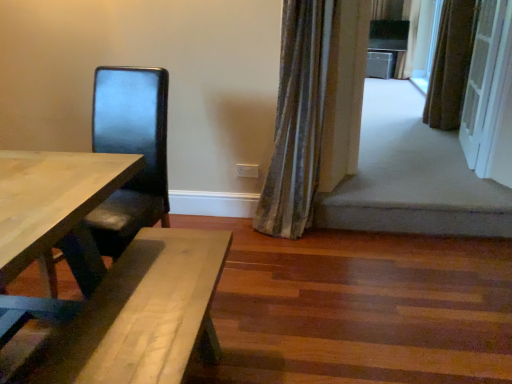
Question: Does velvet-like curtain at upper right, the 1th curtain viewed from the left, have a smaller size compared to white textured screen door at upper right?

Choices:
 (A) yes
 (B) no

Answer: (B)

Question: Is velvet-like curtain at upper right, acting as the 1th curtain starting from the bottom, shorter than white textured screen door at upper right?

Choices:
 (A) no
 (B) yes

Answer: (A)

Question: Is white textured screen door at upper right located within velvet-like curtain at upper right, the 3th curtain positioned from the right?

Choices:
 (A) yes
 (B) no

Answer: (B)

Question: From a real-world perspective, is velvet-like curtain at upper right, the 1th curtain viewed from the left, physically above white textured screen door at upper right?

Choices:
 (A) no
 (B) yes

Answer: (A)

Question: From the image's perspective, is velvet-like curtain at upper right, the third curtain viewed from the back, located above white textured screen door at upper right?

Choices:
 (A) no
 (B) yes

Answer: (A)

Question: From a real-world perspective, is velvet-like curtain at upper right, the third curtain viewed from the back, beneath white textured screen door at upper right?

Choices:
 (A) no
 (B) yes

Answer: (B)

Question: From a real-world perspective, is matte black chair at left located higher than brown textured curtain at upper right, which is the second curtain from top to bottom?

Choices:
 (A) yes
 (B) no

Answer: (B)

Question: Does matte black chair at left have a lesser height compared to brown textured curtain at upper right, the 2th curtain in the right-to-left sequence?

Choices:
 (A) no
 (B) yes

Answer: (B)

Question: Considering the relative sizes of matte black chair at left and brown textured curtain at upper right, positioned as the 2th curtain in front-to-back order, in the image provided, is matte black chair at left smaller than brown textured curtain at upper right, positioned as the 2th curtain in front-to-back order,?

Choices:
 (A) no
 (B) yes

Answer: (A)

Question: Is matte black chair at left at the right side of brown textured curtain at upper right, positioned as the 2th curtain in front-to-back order?

Choices:
 (A) yes
 (B) no

Answer: (B)

Question: From a real-world perspective, does matte black chair at left sit lower than brown textured curtain at upper right, the 2th curtain in the right-to-left sequence?

Choices:
 (A) yes
 (B) no

Answer: (A)

Question: Is matte black chair at left far from brown textured curtain at upper right, the 2th curtain in the right-to-left sequence?

Choices:
 (A) yes
 (B) no

Answer: (A)

Question: Could you tell me if striped fabric curtain at upper right, the 3th curtain from the left, is turned towards white textured screen door at upper right?

Choices:
 (A) yes
 (B) no

Answer: (B)